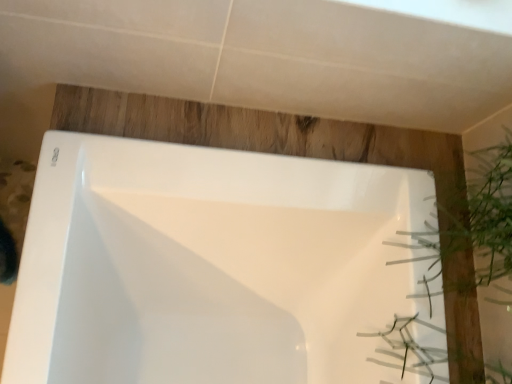
This screenshot has width=512, height=384. I want to click on green leafy plant at upper right, so click(x=461, y=235).

The image size is (512, 384). What do you see at coordinates (461, 235) in the screenshot?
I see `green leafy plant at upper right` at bounding box center [461, 235].

Identify the location of green leafy plant at upper right. This screenshot has width=512, height=384. (461, 235).